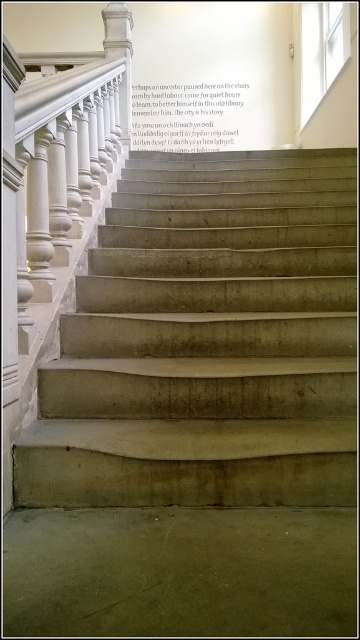
You are a maintenance worker needing to reach the white marble pillar at upper center from the brown concrete floor at lower center. The tools you carry require a minimum of 3.5 meters of space to operate safely. Can you safely operate your tools in the available space between them?

Result: The brown concrete floor at lower center is 3.49 meters away from white marble pillar at upper center. Since the required minimum distance is 3.5 meters, the available space is slightly less than needed. Therefore, you cannot safely operate your tools in the available space between them.

You are standing at the bottom of the staircase and want to place a small potted plant on the brown concrete floor at lower center. According to the coordinates provided, is the floor at a central position along the horizontal axis?

The brown concrete floor at lower center is located at point (180, 572). The y coordinate 0.500 indicates it is at the central position along the horizontal axis.